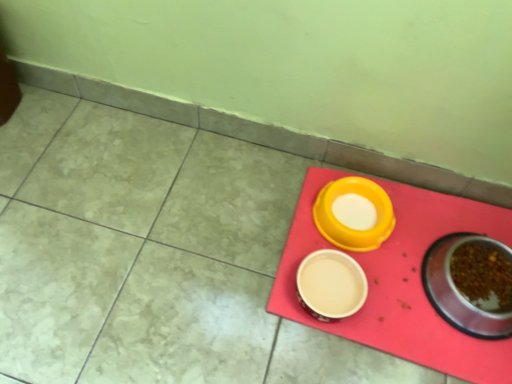
The width and height of the screenshot is (512, 384). In order to click on free space behind beige ceramic bowl at center, the first tableware in the left-to-right sequence in this screenshot , I will do `click(285, 206)`.